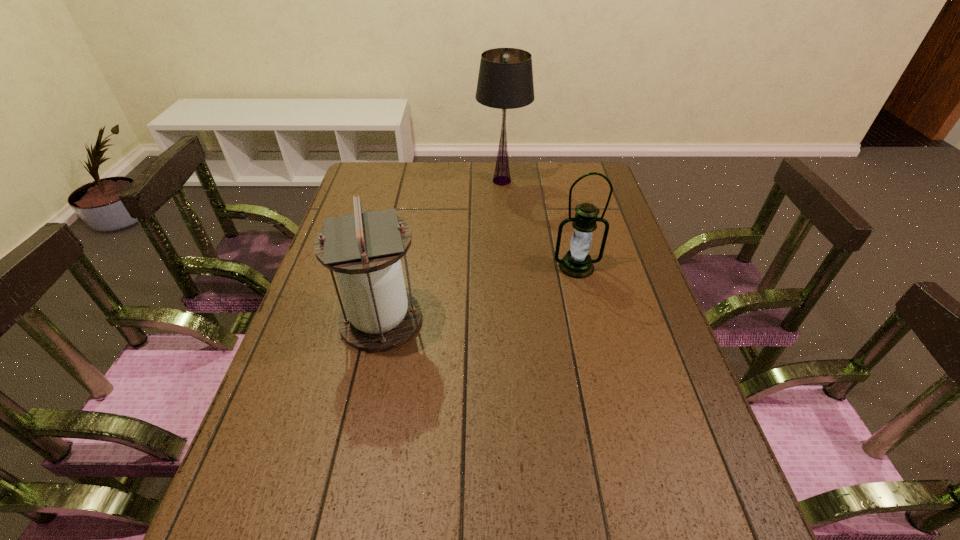
Identify the location of the second object from right to left. This screenshot has height=540, width=960. (505, 81).

The height and width of the screenshot is (540, 960). I want to click on the farthest object, so click(x=505, y=81).

The image size is (960, 540). Find the location of `the left lantern`. the left lantern is located at coordinates (364, 248).

Find the location of a particular element. The image size is (960, 540). the leftmost object is located at coordinates (364, 248).

Where is `the farther lantern`? This screenshot has height=540, width=960. the farther lantern is located at coordinates [x=577, y=263].

At what (x,y) coordinates should I click in order to perform the action: click on the rightmost object. Please return your answer as a coordinate pair (x, y). Looking at the image, I should click on (577, 263).

In order to click on vacant space located on the front-facing side of the farthest object in this screenshot , I will do `click(506, 235)`.

At what (x,y) coordinates should I click in order to perform the action: click on vacant space situated 0.260m on the right of the left lantern. Please return your answer as a coordinate pair (x, y). The image size is (960, 540). Looking at the image, I should click on (524, 320).

The image size is (960, 540). Find the location of `vacant area located on the side where the second nearest object emits light`. vacant area located on the side where the second nearest object emits light is located at coordinates (590, 325).

This screenshot has width=960, height=540. I want to click on object that is at the far edge, so click(505, 81).